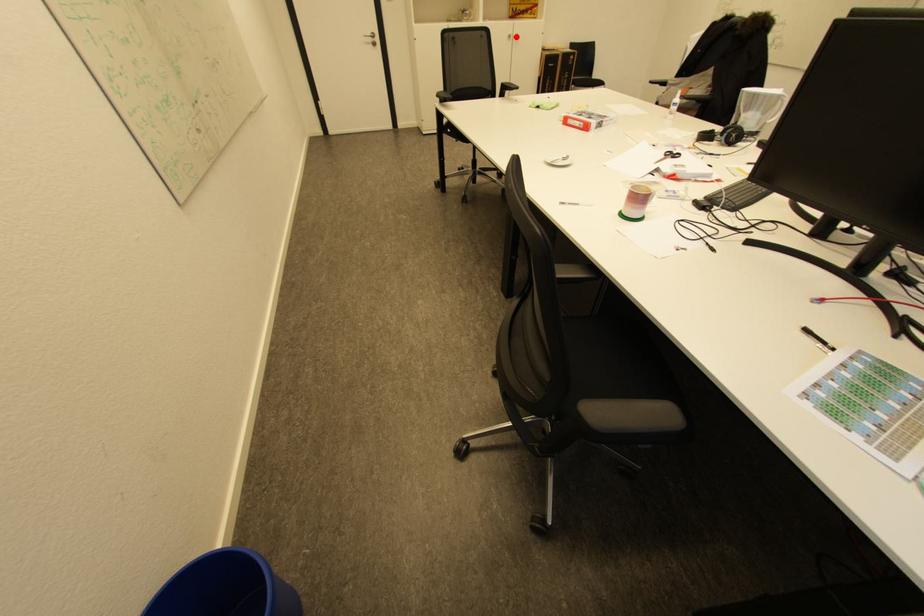
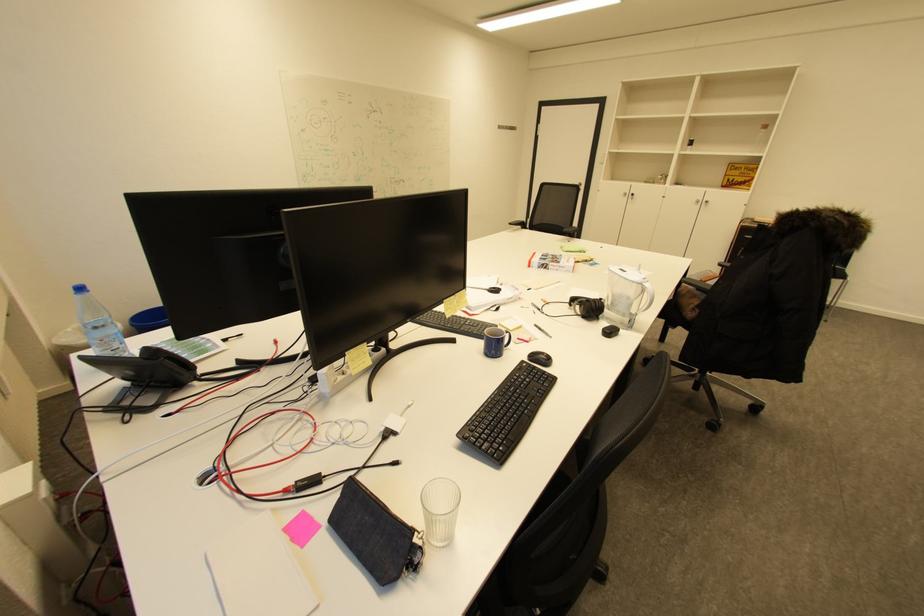
Where in the second image is the point corresponding to the highlighted location from the first image?

(703, 201)